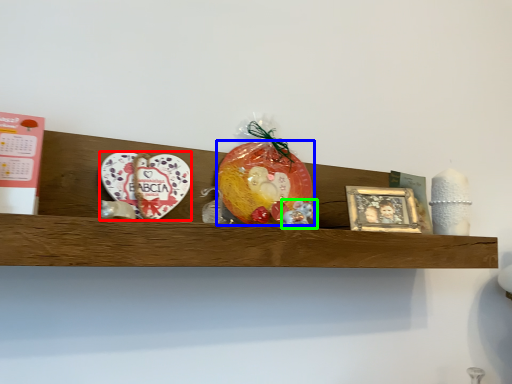
Question: Which is nearer to the platter (highlighted by a red box)? fruit (highlighted by a blue box) or stuff (highlighted by a green box).

Choices:
 (A) fruit
 (B) stuff

Answer: (A)